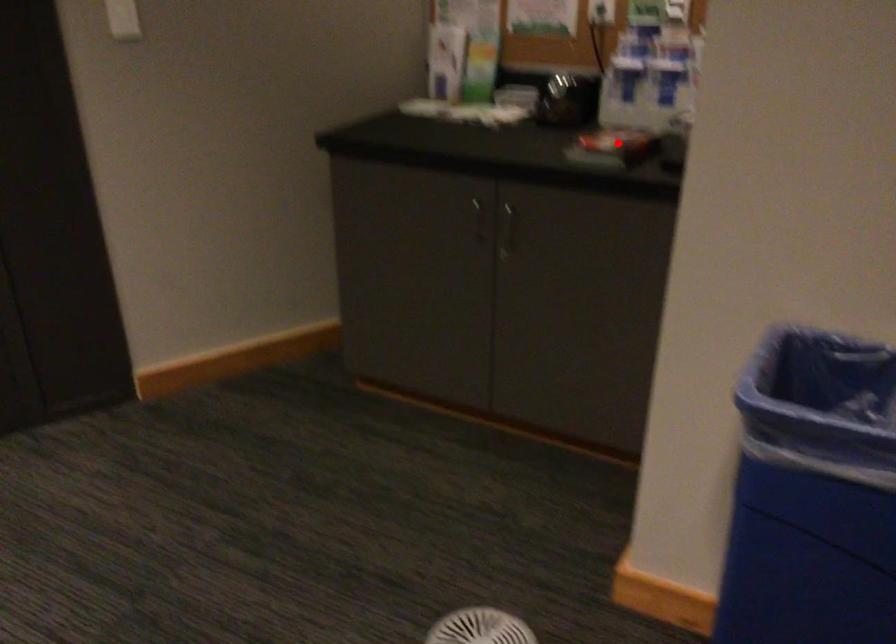
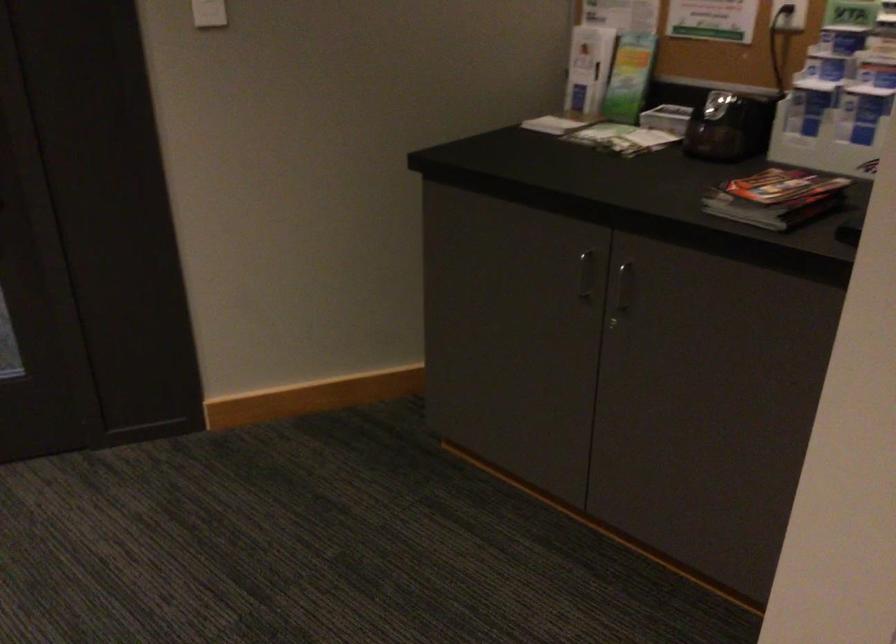
Locate, in the second image, the point that corresponds to the highlighted location in the first image.

(776, 198)